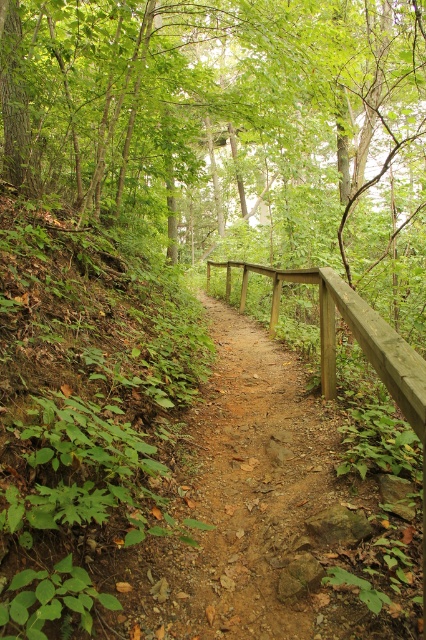
Question: Which object is farther from the camera taking this photo?

Choices:
 (A) wooden rail at center
 (B) green leafy hillside at left

Answer: (A)

Question: From the image, what is the correct spatial relationship of green leafy tree at center in relation to wooden rail at center?

Choices:
 (A) below
 (B) above

Answer: (B)

Question: Which point is farther to the camera?

Choices:
 (A) (261, 198)
 (B) (422, 432)
 (C) (22, 332)

Answer: (A)

Question: Which point is closer to the camera taking this photo?

Choices:
 (A) (328, 268)
 (B) (247, 35)

Answer: (A)

Question: Can you confirm if green leafy tree at center is thinner than wooden rail at center?

Choices:
 (A) no
 (B) yes

Answer: (A)

Question: Can you confirm if green leafy tree at center is smaller than green leafy hillside at left?

Choices:
 (A) yes
 (B) no

Answer: (B)